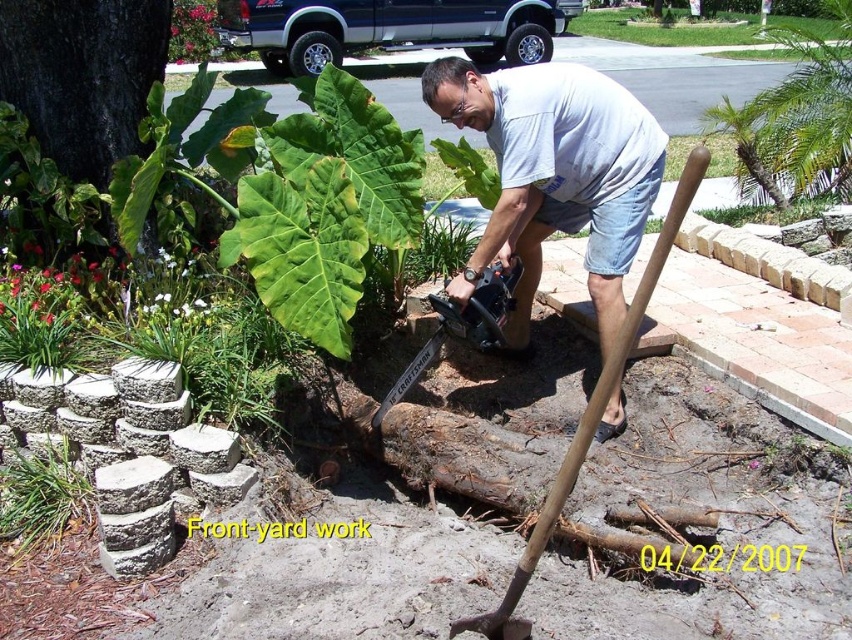
Question: Does dark green leafy tree at upper left lie behind brown wooden shovel at center?

Choices:
 (A) yes
 (B) no

Answer: (A)

Question: Estimate the real-world distances between objects in this image. Which object is farther from the gray matte shirt at center?

Choices:
 (A) brown wooden shovel at center
 (B) green grass at lower left

Answer: (B)

Question: Among these points, which one is farthest from the camera?

Choices:
 (A) (13, 54)
 (B) (540, 525)
 (C) (61, 480)
 (D) (832, 35)

Answer: (D)

Question: Which point is closer to the camera?

Choices:
 (A) green leafy plant at upper center
 (B) brown wooden shovel at center
 (C) dark green leafy tree at upper left

Answer: (B)

Question: Can you confirm if gray matte shirt at center is wider than dark green leafy tree at upper left?

Choices:
 (A) no
 (B) yes

Answer: (B)

Question: Does dark green leafy tree at upper left have a greater width compared to green leafy plant at upper center?

Choices:
 (A) yes
 (B) no

Answer: (A)